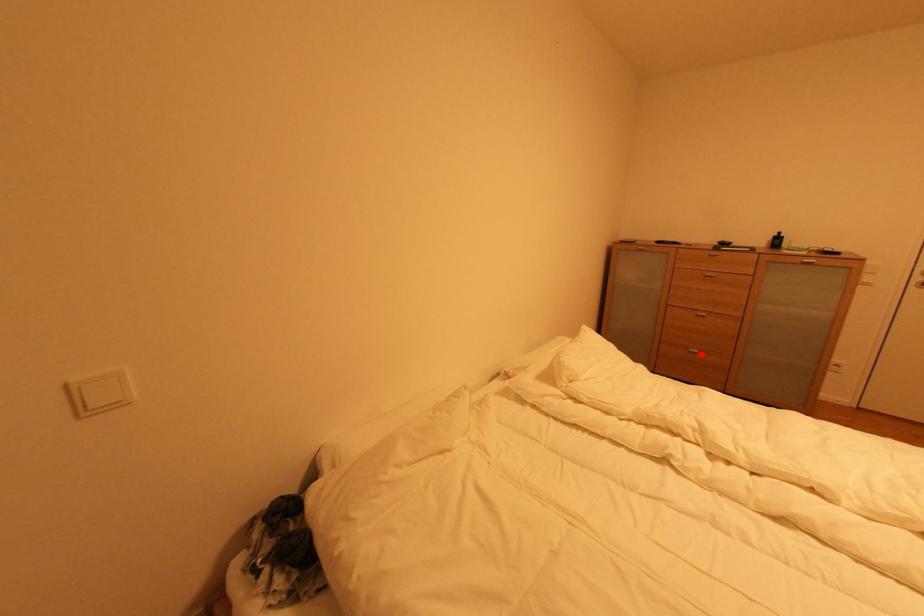
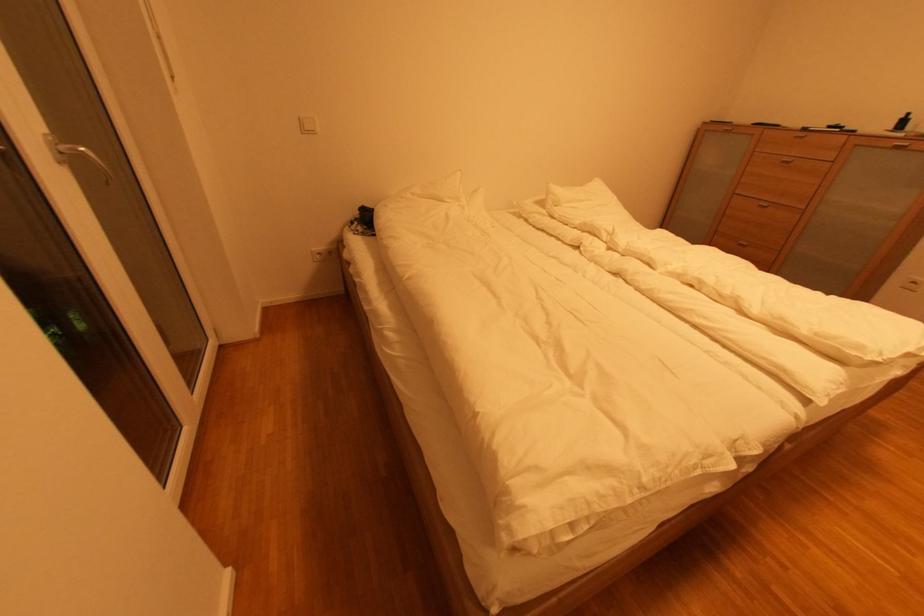
In the second image, find the point that corresponds to the highlighted location in the first image.

(749, 246)